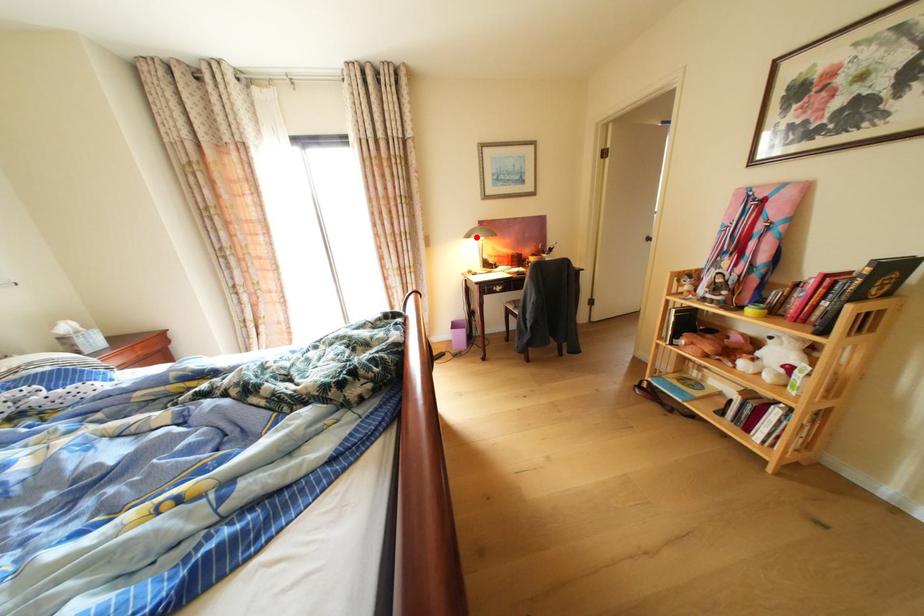
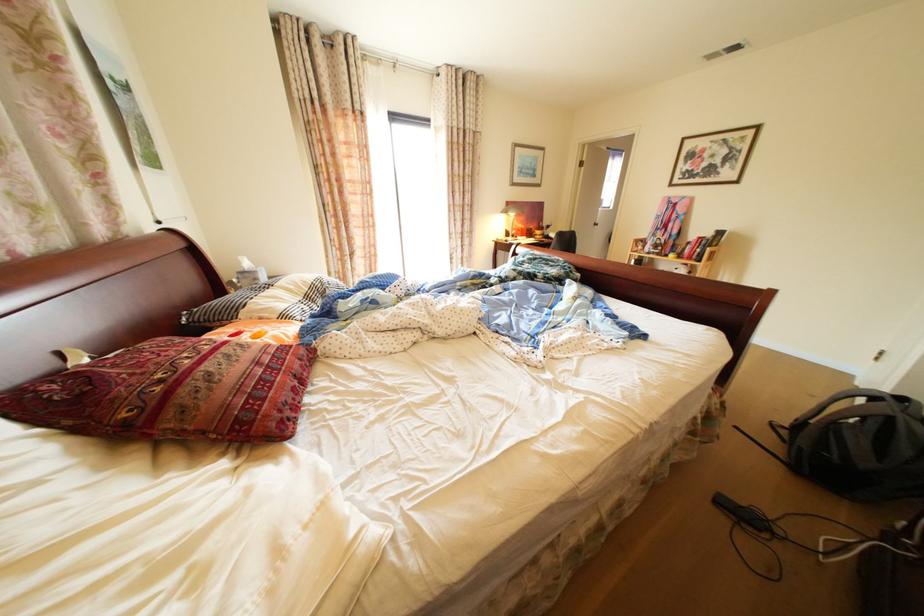
Where in the second image is the point corresponding to the highlighted location from the first image?

(514, 213)